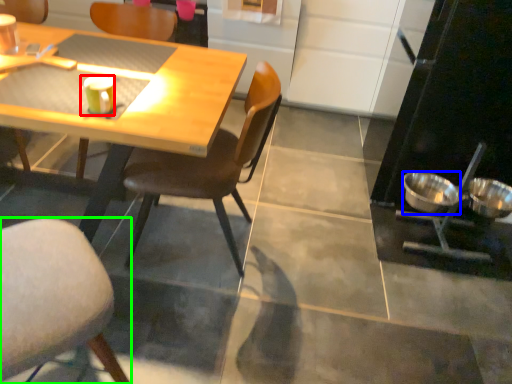
Question: Considering the real-world distances, which object is closest to coffee cup (highlighted by a red box)? bowl (highlighted by a blue box) or chair (highlighted by a green box).

Choices:
 (A) bowl
 (B) chair

Answer: (B)